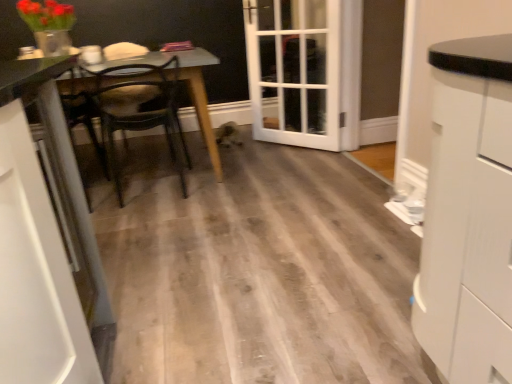
Find the location of a particular element. free space to the right of white glossy cabinet at left, arranged as the 1th cabinetry when viewed from the left is located at coordinates (158, 344).